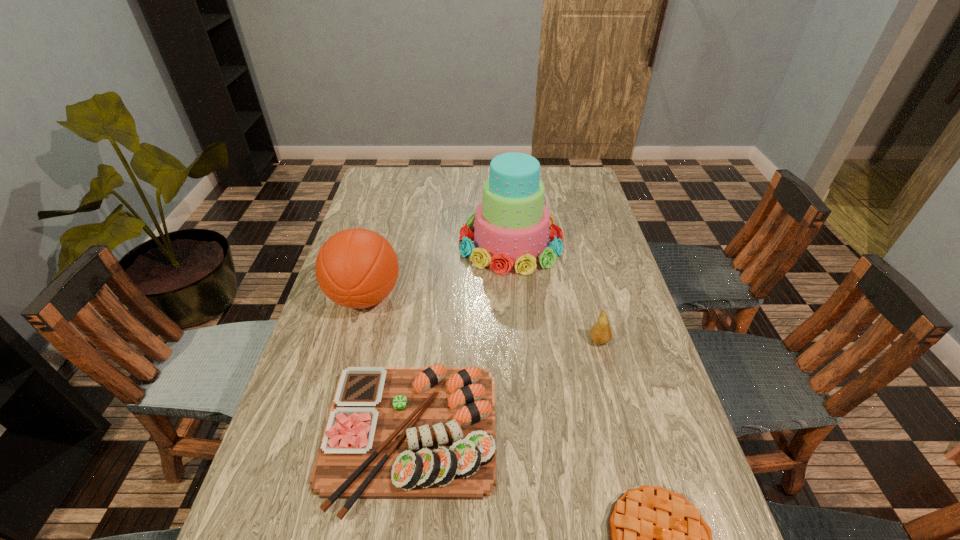
At what (x,y) coordinates should I click in order to perform the action: click on platter present at the left edge. Please return your answer as a coordinate pair (x, y). The image size is (960, 540). Looking at the image, I should click on (392, 432).

The height and width of the screenshot is (540, 960). I want to click on object located at the right edge, so click(601, 333).

What are the coordinates of `vacant area at the far edge` in the screenshot? It's located at (481, 198).

The height and width of the screenshot is (540, 960). What are the coordinates of `vacant space at the right edge` in the screenshot? It's located at (676, 474).

Where is `vacant area at the far left corner of the desktop`? Image resolution: width=960 pixels, height=540 pixels. vacant area at the far left corner of the desktop is located at coordinates pyautogui.click(x=391, y=197).

Locate an element on the screen. The height and width of the screenshot is (540, 960). vacant space that is in between the pear and the cake is located at coordinates point(555,292).

Locate an element on the screen. Image resolution: width=960 pixels, height=540 pixels. vacant area that lies between the basketball and the third tallest object is located at coordinates (482, 319).

This screenshot has width=960, height=540. I want to click on free spot between the third tallest object and the basketball, so click(x=482, y=319).

The width and height of the screenshot is (960, 540). Find the location of `vacant area that lies between the tallest object and the second shortest object`. vacant area that lies between the tallest object and the second shortest object is located at coordinates (462, 340).

Where is `vacant area that lies between the fourth shortest object and the platter`? vacant area that lies between the fourth shortest object and the platter is located at coordinates (389, 367).